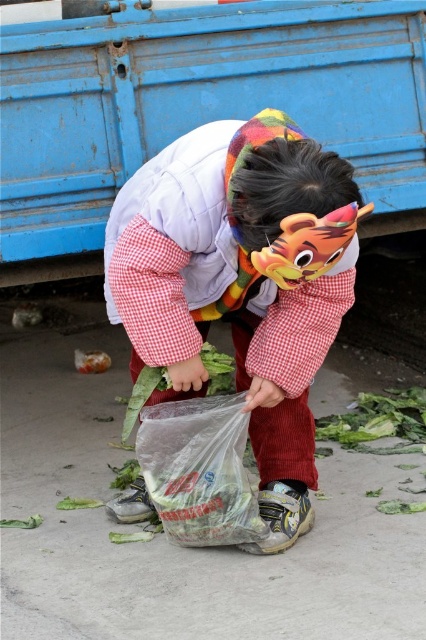
Question: Is white corduroy pants at center thinner than transparent plastic bag at center?

Choices:
 (A) no
 (B) yes

Answer: (A)

Question: Is white corduroy pants at center positioned before transparent plastic bag at center?

Choices:
 (A) no
 (B) yes

Answer: (B)

Question: Which point appears farthest from the camera in this image?

Choices:
 (A) (250, 186)
 (B) (195, 419)

Answer: (B)

Question: Can you confirm if white corduroy pants at center is thinner than transparent plastic bag at center?

Choices:
 (A) yes
 (B) no

Answer: (B)